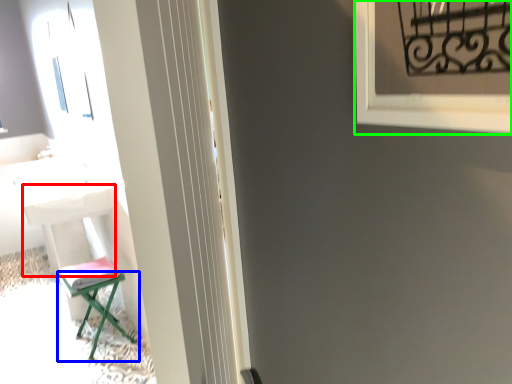
Question: Considering the real-world distances, which object is closest to table (highlighted by a red box)? furniture (highlighted by a blue box) or window frame (highlighted by a green box).

Choices:
 (A) furniture
 (B) window frame

Answer: (A)